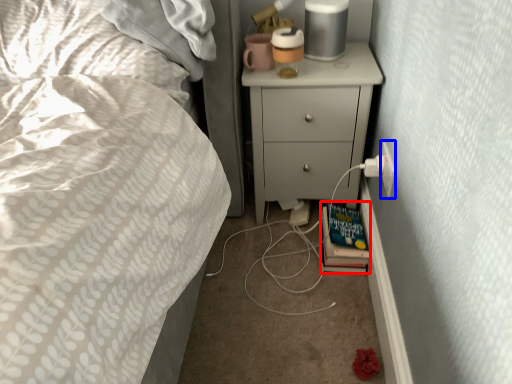
Question: Which of the following is the closest to the observer, book (highlighted by a red box) or electric outlet (highlighted by a blue box)?

Choices:
 (A) book
 (B) electric outlet

Answer: (B)